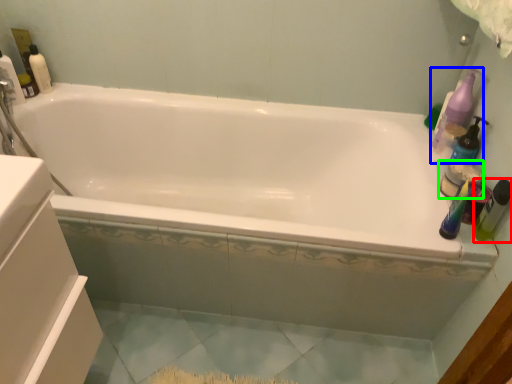
Question: Estimate the real-world distances between objects in this image. Which object is closer to toiletry (highlighted by a red box), cleaning product (highlighted by a blue box) or toiletry (highlighted by a green box)?

Choices:
 (A) cleaning product
 (B) toiletry

Answer: (B)